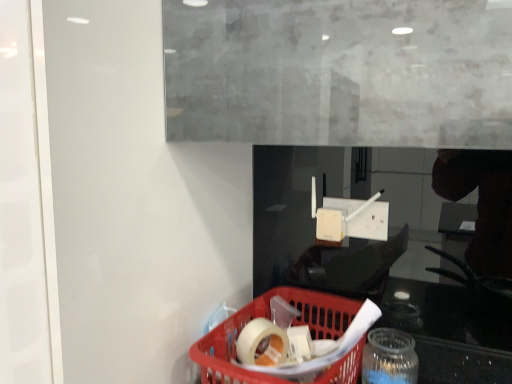
Question: Is translucent plastic basket at lower center at the back of transparent glass jar at lower right?

Choices:
 (A) no
 (B) yes

Answer: (A)

Question: From the image's perspective, is transparent glass jar at lower right over translucent plastic basket at lower center?

Choices:
 (A) no
 (B) yes

Answer: (A)

Question: Can you confirm if transparent glass jar at lower right is positioned to the left of translucent plastic basket at lower center?

Choices:
 (A) yes
 (B) no

Answer: (B)

Question: Is transparent glass jar at lower right wider than translucent plastic basket at lower center?

Choices:
 (A) no
 (B) yes

Answer: (A)

Question: Is transparent glass jar at lower right not close to translucent plastic basket at lower center?

Choices:
 (A) no
 (B) yes

Answer: (A)

Question: Relative to transparent glass jar at lower right, is red plastic basket at lower center in front or behind?

Choices:
 (A) front
 (B) behind

Answer: (A)

Question: From the image's perspective, is red plastic basket at lower center located above or below transparent glass jar at lower right?

Choices:
 (A) below
 (B) above

Answer: (B)

Question: From their relative heights in the image, would you say red plastic basket at lower center is taller or shorter than transparent glass jar at lower right?

Choices:
 (A) short
 (B) tall

Answer: (B)

Question: Is point (480, 375) positioned closer to the camera than point (401, 362)?

Choices:
 (A) closer
 (B) farther

Answer: (B)

Question: In terms of width, does transparent glass jar at lower right look wider or thinner when compared to translucent plastic basket at lower center?

Choices:
 (A) wide
 (B) thin

Answer: (B)

Question: In the image, is transparent glass jar at lower right on the left side or the right side of translucent plastic basket at lower center?

Choices:
 (A) right
 (B) left

Answer: (A)

Question: From the image's perspective, is transparent glass jar at lower right above or below translucent plastic basket at lower center?

Choices:
 (A) above
 (B) below

Answer: (B)

Question: Would you say transparent glass jar at lower right is inside or outside translucent plastic basket at lower center?

Choices:
 (A) inside
 (B) outside

Answer: (B)

Question: From a real-world perspective, is red plastic basket at lower center above or below translucent plastic basket at lower center?

Choices:
 (A) above
 (B) below

Answer: (A)

Question: Would you say red plastic basket at lower center is inside or outside translucent plastic basket at lower center?

Choices:
 (A) inside
 (B) outside

Answer: (B)